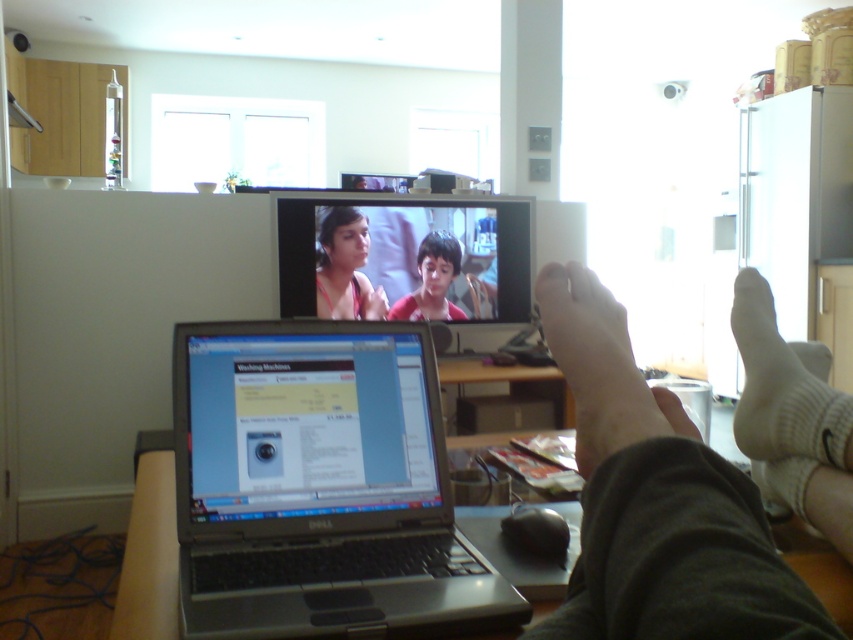
Question: Estimate the real-world distances between objects in this image. Which object is closer to the silver metallic laptop at center?

Choices:
 (A) matte pink fabric at upper center
 (B) white soft foot at lower right

Answer: (B)

Question: Which object is the farthest from the matte pink fabric at upper center?

Choices:
 (A) matte plastic television at upper center
 (B) silver metallic laptop at center

Answer: (B)

Question: Which point is closer to the camera?

Choices:
 (A) matte plastic television at upper center
 (B) white soft foot at lower right

Answer: (B)

Question: Can you confirm if silver metallic laptop at center is positioned above matte red shirt at center?

Choices:
 (A) yes
 (B) no

Answer: (B)

Question: Can you confirm if silver metallic laptop at center is positioned below matte plastic television at upper center?

Choices:
 (A) yes
 (B) no

Answer: (A)

Question: Where is matte plastic television at upper center located in relation to matte pink fabric at upper center in the image?

Choices:
 (A) above
 (B) below

Answer: (A)